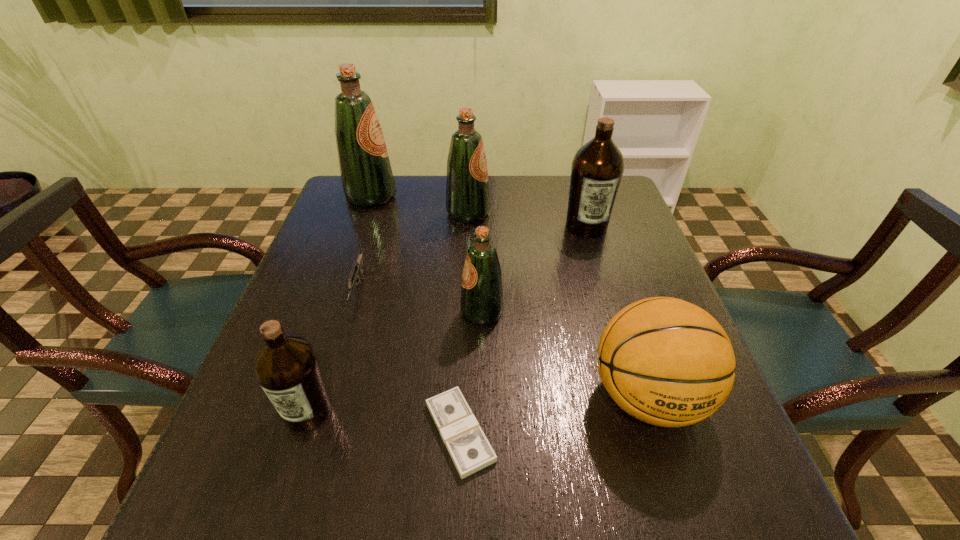
Locate an element on the screen. vacant space at the left edge is located at coordinates (243, 394).

Find the location of `vacant space at the far left corner of the desktop`. vacant space at the far left corner of the desktop is located at coordinates (345, 204).

Identify the location of vacant area at the near right corner of the desktop. The height and width of the screenshot is (540, 960). (735, 503).

Image resolution: width=960 pixels, height=540 pixels. I want to click on vacant space that's between the bigger brown olive oil and the shortest object, so click(523, 329).

Locate an element on the screen. The height and width of the screenshot is (540, 960). blank region between the farther brown olive oil and the shortest object is located at coordinates (523, 329).

Where is `vacant point located between the fourth farthest olive oil and the tallest olive oil`? The image size is (960, 540). vacant point located between the fourth farthest olive oil and the tallest olive oil is located at coordinates (426, 255).

I want to click on free space between the orange basketball and the farther brown olive oil, so click(617, 311).

Find the location of a particular element. vacant space in between the tallest olive oil and the smaller brown olive oil is located at coordinates (340, 304).

In order to click on unoccupied position between the second smallest green olive oil and the nearer brown olive oil in this screenshot , I will do `click(388, 312)`.

Where is `vacant point located between the second shortest object and the nearest green olive oil`? This screenshot has height=540, width=960. vacant point located between the second shortest object and the nearest green olive oil is located at coordinates (420, 300).